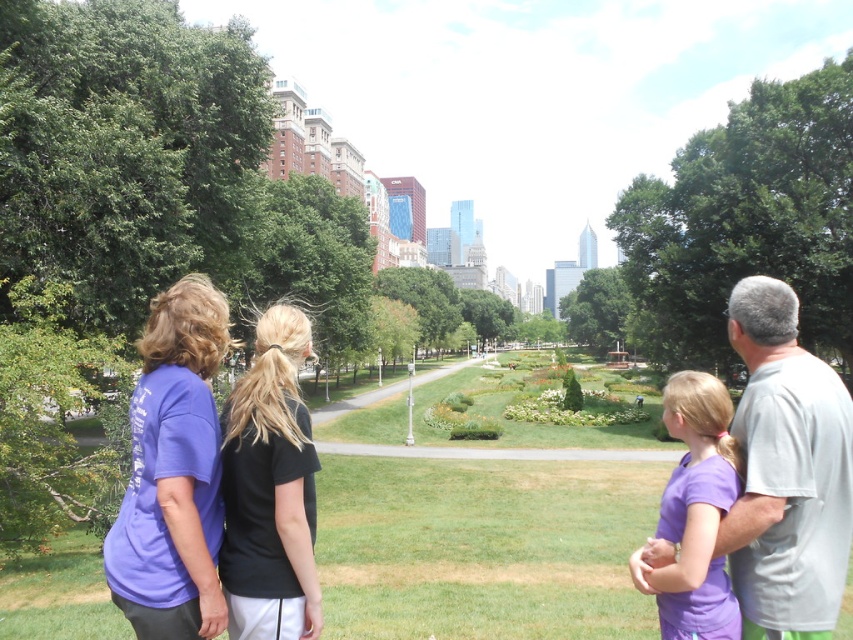
You are standing in the park and see the gray cotton shirt at right and the black matte shirt at center. Which person is positioned to the right of the other?

The gray cotton shirt at right is positioned to the right of the black matte shirt at center.

You are organizing a group photo and need to arrange the gray cotton shirt at right and the black matte shirt at center based on their sizes. Which shirt should be placed in the front row to ensure visibility?

The gray cotton shirt at right has a larger size compared to the black matte shirt at center, so placing the gray cotton shirt at right in the front row would ensure visibility since it is bigger and can be seen more easily.